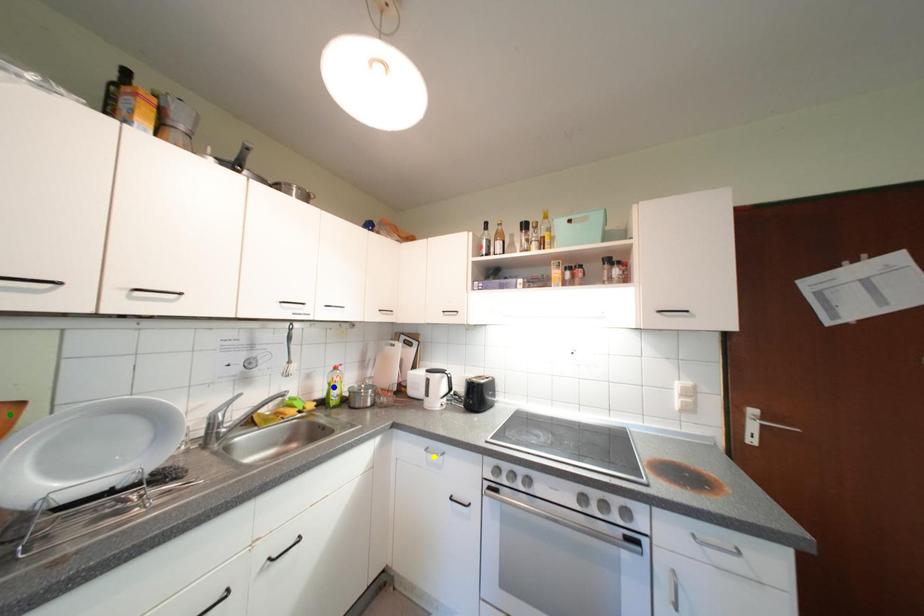
Order these from nearest to farthest:
1. yellow point
2. green point
3. blue point

1. green point
2. yellow point
3. blue point